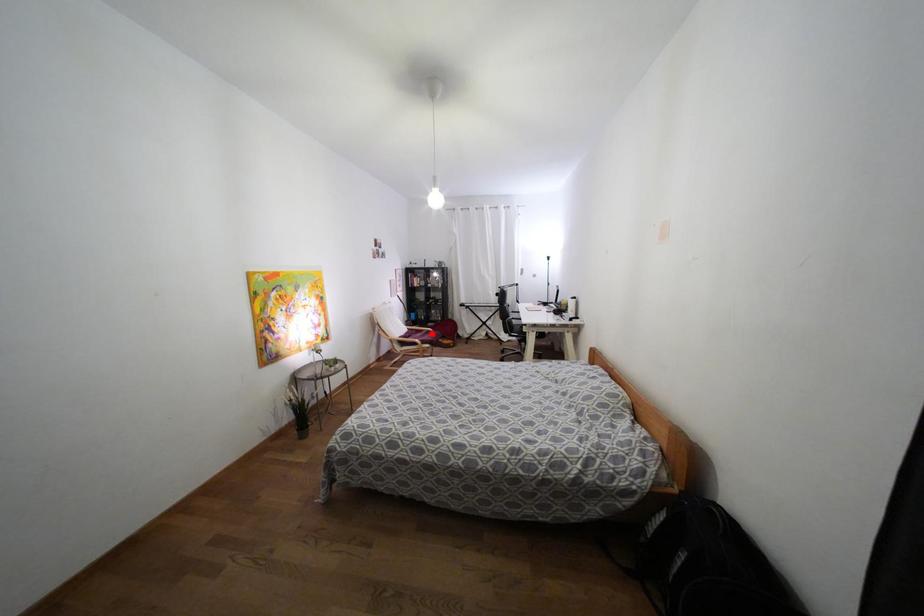
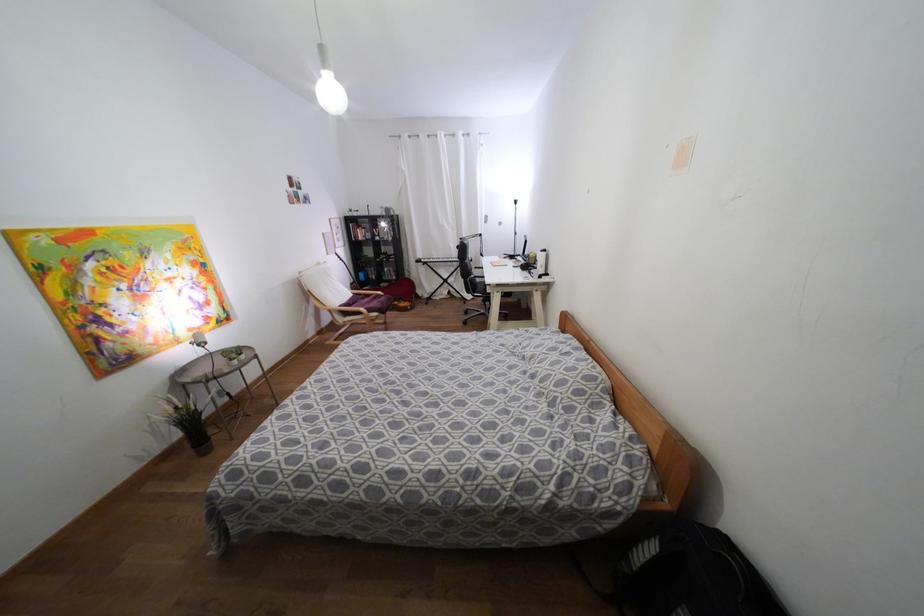
Question: I am providing you with two images of the same scene from different viewpoints. A red point is shown in image1. For the corresponding object point in image2, is it positioned nearer or farther from the camera?

Choices:
 (A) Nearer
 (B) Farther

Answer: (A)